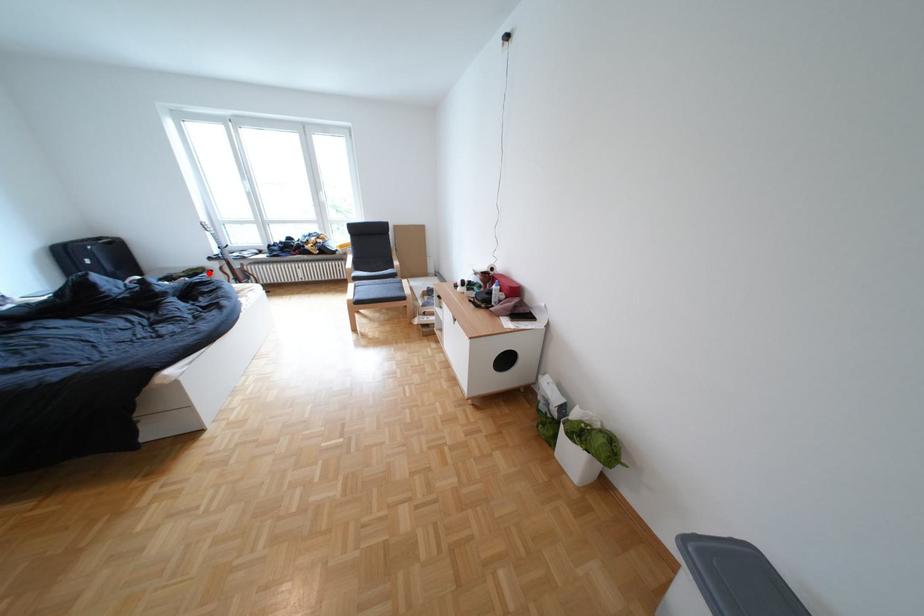
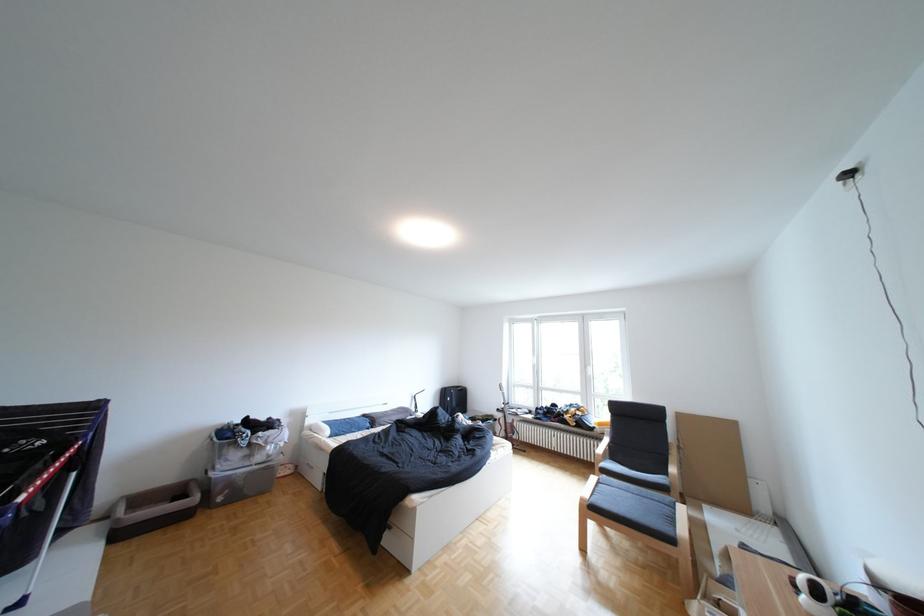
Question: I am providing you with two images of the same scene from different viewpoints. In image1, a red point is highlighted. Considering the same 3D point in image2, which of the following is correct?

Choices:
 (A) It is closer
 (B) It is farther

Answer: (B)